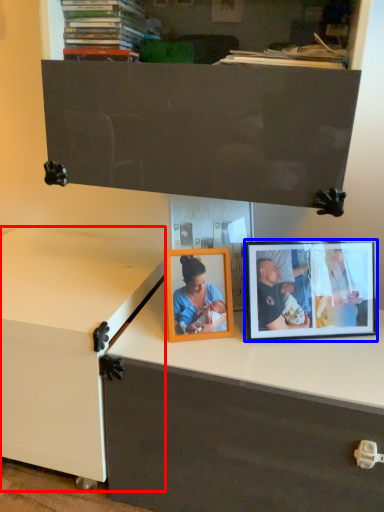
Question: Which point is closer to the camera, changing table (highlighted by a red box) or picture frame (highlighted by a blue box)?

Choices:
 (A) changing table
 (B) picture frame

Answer: (A)